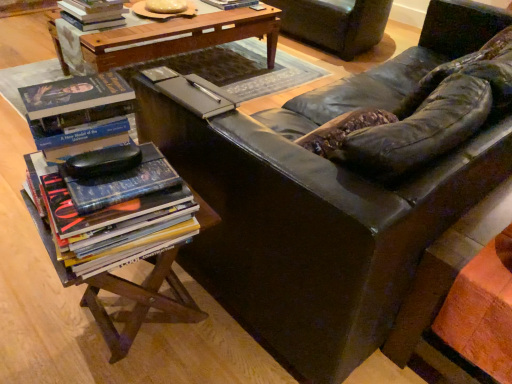
Question: From the image's perspective, would you say woodenmaterial/texturetable at lower left, marked as the second table in a back-to-front arrangement, is shown under hardcover book at upper center, which is counted as the 3th book, starting from the front?

Choices:
 (A) no
 (B) yes

Answer: (B)

Question: Can you confirm if woodenmaterial/texturetable at lower left, marked as the second table in a back-to-front arrangement, is positioned to the right of hardcover book at upper center, positioned as the 3th book in bottom-to-top order?

Choices:
 (A) yes
 (B) no

Answer: (B)

Question: Would you say woodenmaterial/texturetable at lower left, marked as the second table in a back-to-front arrangement, is outside hardcover book at upper center, arranged as the first book when viewed from the top?

Choices:
 (A) no
 (B) yes

Answer: (B)

Question: Is woodenmaterial/texturetable at lower left, arranged as the first table when viewed from the front, not close to hardcover book at upper center, placed as the first book when sorted from right to left?

Choices:
 (A) yes
 (B) no

Answer: (A)

Question: Does woodenmaterial/texturetable at lower left, marked as the 2th table in a top-to-bottom arrangement, have a lesser width compared to hardcover book at upper center, which is counted as the 3th book, starting from the front?

Choices:
 (A) yes
 (B) no

Answer: (B)

Question: Is hardcover books at left, which is the 2th book in left-to-right order, wider or thinner than woodenmaterial/texturetable at lower left, marked as the second table in a back-to-front arrangement?

Choices:
 (A) thin
 (B) wide

Answer: (A)

Question: In the image, is hardcover books at left, placed as the first book when sorted from bottom to top, positioned in front of or behind woodenmaterial/texturetable at lower left, the first table in the bottom-to-top sequence?

Choices:
 (A) behind
 (B) front

Answer: (B)

Question: Considering the positions of point (79, 231) and point (173, 292), is point (79, 231) closer or farther from the camera than point (173, 292)?

Choices:
 (A) closer
 (B) farther

Answer: (A)

Question: Would you say hardcover books at left, the first book positioned from the front, is inside or outside woodenmaterial/texturetable at lower left, arranged as the first table when viewed from the front?

Choices:
 (A) inside
 (B) outside

Answer: (B)

Question: Considering their positions, is hardcover book at upper left, which is the second book in bottom-to-top order, located in front of or behind wooden table at center, which is the 1th table from back to front?

Choices:
 (A) front
 (B) behind

Answer: (B)

Question: From the image's perspective, is hardcover book at upper left, marked as the 1th book in a left-to-right arrangement, positioned above or below wooden table at center, which is the 1th table from back to front?

Choices:
 (A) above
 (B) below

Answer: (A)

Question: Considering the positions of hardcover book at upper left, marked as the 1th book in a left-to-right arrangement, and wooden table at center, which is the 1th table from back to front, in the image, is hardcover book at upper left, marked as the 1th book in a left-to-right arrangement, taller or shorter than wooden table at center, which is the 1th table from back to front,?

Choices:
 (A) tall
 (B) short

Answer: (B)

Question: Considering the positions of hardcover book at upper left, which is the second book in bottom-to-top order, and wooden table at center, the 2th table in the bottom-to-top sequence, in the image, is hardcover book at upper left, which is the second book in bottom-to-top order, wider or thinner than wooden table at center, the 2th table in the bottom-to-top sequence,?

Choices:
 (A) thin
 (B) wide

Answer: (A)

Question: In terms of height, does hardcover book at upper left, which is the second book in bottom-to-top order, look taller or shorter compared to velvet dark brown armchair at upper center?

Choices:
 (A) tall
 (B) short

Answer: (B)

Question: Is point (89, 16) closer or farther from the camera than point (360, 46)?

Choices:
 (A) farther
 (B) closer

Answer: (B)